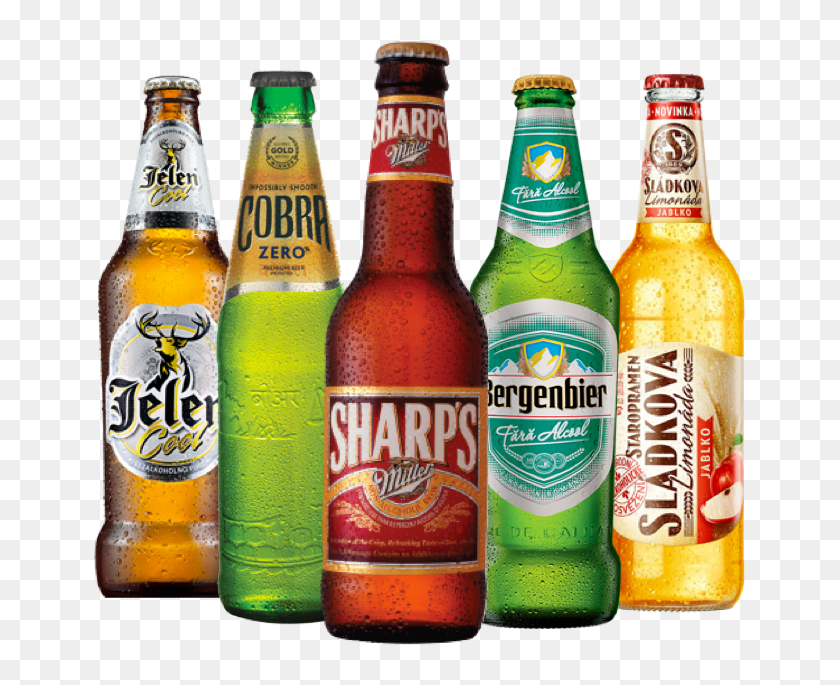
Find the location of a particular element. The width and height of the screenshot is (840, 685). beer bottles is located at coordinates (180, 420), (284, 405), (421, 425), (537, 435), (667, 436).